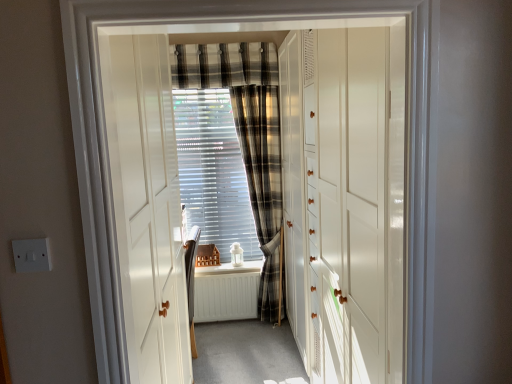
Question: Is white glossy cabinet at center, which is counted as the 1th door, starting from the back, placed right next to plaid fabric curtain at center, positioned as the 1th curtain in bottom-to-top order?

Choices:
 (A) no
 (B) yes

Answer: (A)

Question: Is white glossy cabinet at center, which is the second door from front to back, facing towards plaid fabric curtain at center, positioned as the 1th curtain in bottom-to-top order?

Choices:
 (A) no
 (B) yes

Answer: (B)

Question: From a real-world perspective, is white glossy cabinet at center, which is counted as the 1th door, starting from the back, physically below plaid fabric curtain at center, the second curtain when ordered from top to bottom?

Choices:
 (A) yes
 (B) no

Answer: (B)

Question: From the image's perspective, is white glossy cabinet at center, which is the second door from front to back, beneath plaid fabric curtain at center, positioned as the 1th curtain in bottom-to-top order?

Choices:
 (A) no
 (B) yes

Answer: (B)

Question: Is white glossy cabinet at center, which is counted as the 1th door, starting from the back, positioned with its back to plaid fabric curtain at center, the second curtain when ordered from top to bottom?

Choices:
 (A) yes
 (B) no

Answer: (B)

Question: Would you say plaid fabric curtain at center, the second curtain when ordered from top to bottom, is part of white glossy cabinet at center, which is the second door from front to back,'s contents?

Choices:
 (A) no
 (B) yes

Answer: (A)

Question: Does plaid fabric curtain at upper center, which is the second curtain in bottom-to-top order, have a lesser height compared to white glossy door at center, placed as the 2th door when sorted from back to front?

Choices:
 (A) yes
 (B) no

Answer: (A)

Question: Would you say white glossy door at center, which ranks as the first door in front-to-back order, is part of plaid fabric curtain at upper center, marked as the first curtain in a top-to-bottom arrangement,'s contents?

Choices:
 (A) yes
 (B) no

Answer: (B)

Question: Considering the relative positions of plaid fabric curtain at upper center, marked as the first curtain in a top-to-bottom arrangement, and white glossy door at center, which ranks as the first door in front-to-back order, in the image provided, is plaid fabric curtain at upper center, marked as the first curtain in a top-to-bottom arrangement, to the left of white glossy door at center, which ranks as the first door in front-to-back order, from the viewer's perspective?

Choices:
 (A) yes
 (B) no

Answer: (A)

Question: Would you consider plaid fabric curtain at upper center, which is the second curtain in bottom-to-top order, to be distant from white glossy door at center, placed as the 2th door when sorted from back to front?

Choices:
 (A) yes
 (B) no

Answer: (A)

Question: From a real-world perspective, is plaid fabric curtain at upper center, which is the second curtain in bottom-to-top order, under white glossy door at center, which ranks as the first door in front-to-back order?

Choices:
 (A) no
 (B) yes

Answer: (A)

Question: Is the position of plaid fabric curtain at upper center, marked as the first curtain in a top-to-bottom arrangement, less distant than that of white glossy door at center, which ranks as the first door in front-to-back order?

Choices:
 (A) no
 (B) yes

Answer: (A)

Question: From a real-world perspective, is plaid fabric curtain at center, the second curtain when ordered from top to bottom, on top of white plastic switch at lower left?

Choices:
 (A) no
 (B) yes

Answer: (A)